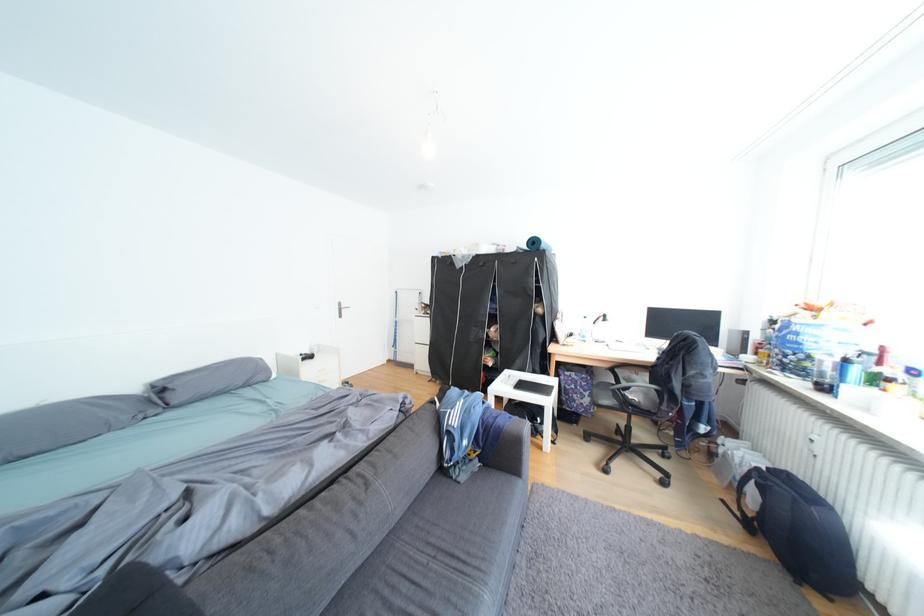
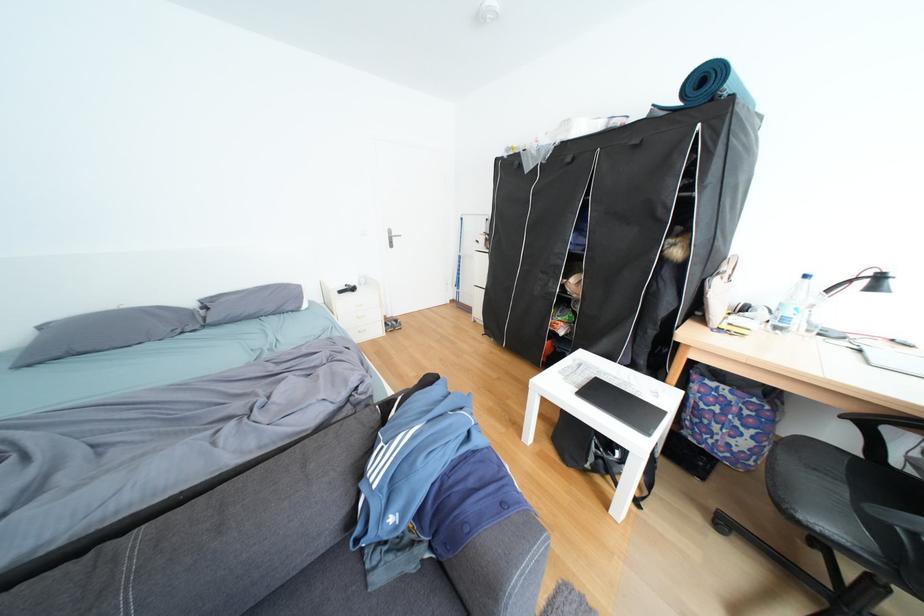
Which direction would the cameraman need to move to produce the second image?

The movement direction of the cameraman is right, forward.